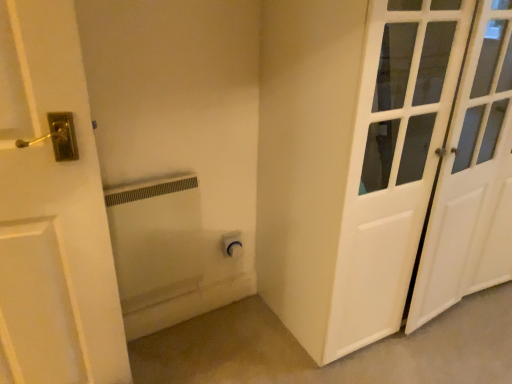
Question: From a real-world perspective, is white matte outlet at lower center above or below white matte radiator at center?

Choices:
 (A) below
 (B) above

Answer: (A)

Question: Considering the positions of white matte outlet at lower center and white matte radiator at center in the image, is white matte outlet at lower center wider or thinner than white matte radiator at center?

Choices:
 (A) thin
 (B) wide

Answer: (B)

Question: Based on their relative distances, which object is farther from the white matte radiator at center?

Choices:
 (A) white matte outlet at lower center
 (B) white glossy door at right

Answer: (B)

Question: Based on their relative distances, which object is nearer to the white matte radiator at center?

Choices:
 (A) white glossy door at right
 (B) white matte outlet at lower center

Answer: (B)